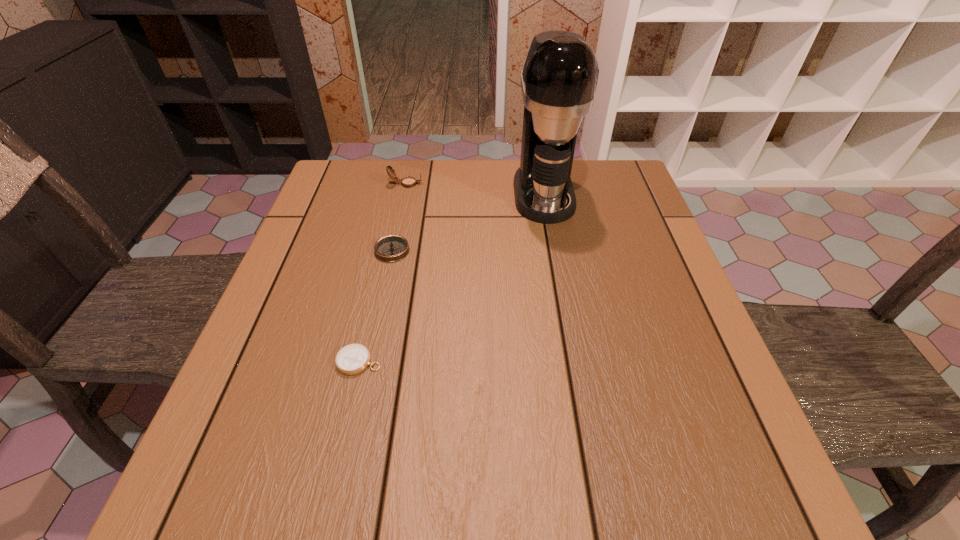
Where is `coffee maker positioned at the far edge`? The height and width of the screenshot is (540, 960). coffee maker positioned at the far edge is located at coordinates (559, 78).

This screenshot has height=540, width=960. I want to click on compass present at the far edge, so click(408, 182).

Locate an element on the screen. This screenshot has height=540, width=960. free space at the far edge of the desktop is located at coordinates click(x=454, y=183).

Image resolution: width=960 pixels, height=540 pixels. In the image, there is a desktop. Identify the location of free region at the near edge. (520, 461).

At what (x,y) coordinates should I click in order to perform the action: click on free space at the left edge of the desktop. Please return your answer as a coordinate pair (x, y). The image size is (960, 540). Looking at the image, I should click on pyautogui.click(x=310, y=370).

The width and height of the screenshot is (960, 540). In the image, there is a desktop. Find the location of `vacant space at the right edge`. vacant space at the right edge is located at coordinates (704, 350).

Locate an element on the screen. The height and width of the screenshot is (540, 960). vacant space at the far left corner is located at coordinates (357, 185).

You are a GUI agent. You are given a task and a screenshot of the screen. Output one action in this format:
    pyautogui.click(x=<x>, y=<y>)
    Task: Click on the unoccupied position between the rightmost object and the nearest compass
    Image resolution: width=960 pixels, height=540 pixels.
    Given the screenshot: What is the action you would take?
    pyautogui.click(x=451, y=278)

At what (x,y) coordinates should I click in order to perform the action: click on empty space between the second farthest compass and the tallest object. Please return your answer as a coordinate pair (x, y). Looking at the image, I should click on (468, 222).

The width and height of the screenshot is (960, 540). What are the coordinates of `vacant area that lies between the rightmost object and the second farthest compass` in the screenshot? It's located at (468, 222).